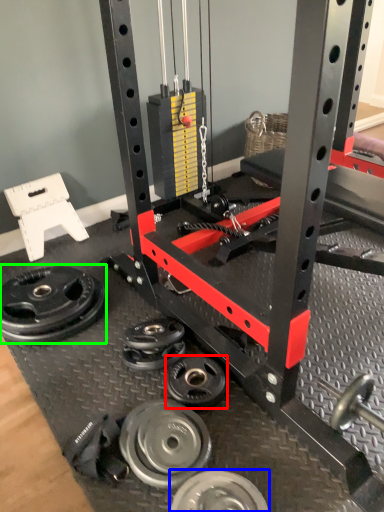
Question: Estimate the real-world distances between objects in this image. Which object is farther from wheel (highlighted by a red box), wheel (highlighted by a blue box) or wheel (highlighted by a green box)?

Choices:
 (A) wheel
 (B) wheel

Answer: (B)